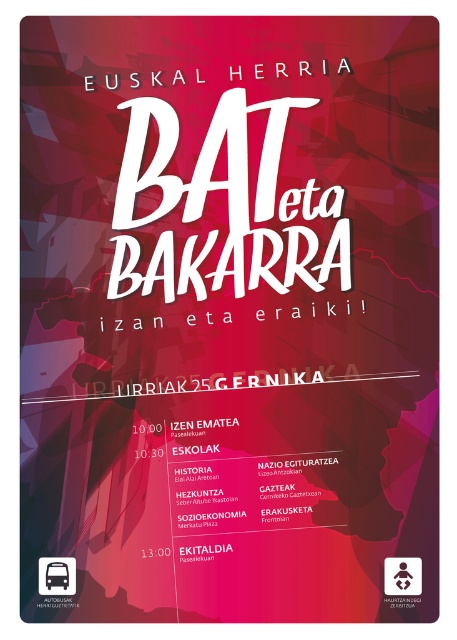
Is point (420, 577) positioned in front of point (185, 552)?

Yes, it is in front of point (185, 552).

This screenshot has width=457, height=640. Describe the element at coordinates (403, 577) in the screenshot. I see `matte red square at center` at that location.

At what (x,y) coordinates should I click in order to perform the action: click on matte red square at center. Please return your answer as a coordinate pair (x, y). This screenshot has height=640, width=457. Looking at the image, I should click on (403, 577).

At what (x,y) coordinates should I click in order to perform the action: click on matte red square at center. Please return your answer as a coordinate pair (x, y). Looking at the image, I should click on (403, 577).

Describe the element at coordinates (202, 552) in the screenshot. The height and width of the screenshot is (640, 457). I see `red matte text at center` at that location.

Which is behind, point (196, 556) or point (153, 556)?

The point (196, 556) is more distant.

The image size is (457, 640). Identify the location of red matte text at center. (202, 552).

Between matte red square at center and white digital clock at center, which one is positioned lower?

Positioned lower is matte red square at center.

Can you confirm if matte red square at center is positioned above white digital clock at center?

Actually, matte red square at center is below white digital clock at center.

Who is more distant from viewer, [400,580] or [159,547]?

Point [159,547]

At what (x,y) coordinates should I click in order to perform the action: click on matte red square at center. Please return your answer as a coordinate pair (x, y). The width and height of the screenshot is (457, 640). Looking at the image, I should click on (403, 577).